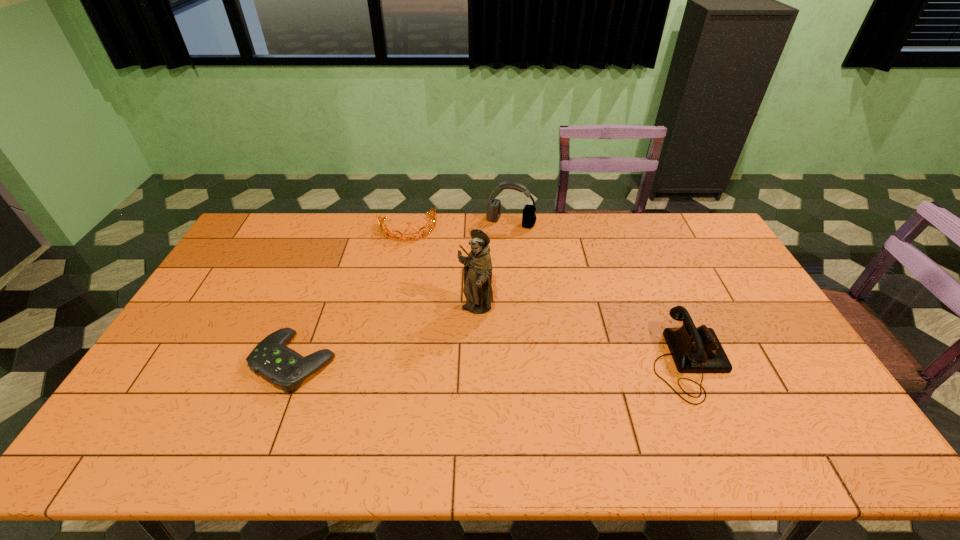
Where is `object that ranks as the third closest to the rightmost object`? The width and height of the screenshot is (960, 540). object that ranks as the third closest to the rightmost object is located at coordinates 432,227.

The image size is (960, 540). Find the location of `free region that satisfies the following two spatial constraints: 1. on the front side of the second tallest object; 2. on the front face of the telephone`. free region that satisfies the following two spatial constraints: 1. on the front side of the second tallest object; 2. on the front face of the telephone is located at coordinates (523, 362).

Find the location of `free space that satisfies the following two spatial constraints: 1. on the front side of the telephone; 2. on the front face of the fourth shortest object`. free space that satisfies the following two spatial constraints: 1. on the front side of the telephone; 2. on the front face of the fourth shortest object is located at coordinates (523, 362).

Where is `vacant space that satisfies the following two spatial constraints: 1. on the back side of the control; 2. on the right side of the headset`? Image resolution: width=960 pixels, height=540 pixels. vacant space that satisfies the following two spatial constraints: 1. on the back side of the control; 2. on the right side of the headset is located at coordinates (348, 222).

You are a GUI agent. You are given a task and a screenshot of the screen. Output one action in this format:
    pyautogui.click(x=<x>, y=<y>)
    Task: Click on the vacant position in the image that satisfies the following two spatial constraints: 1. on the front side of the telephone; 2. on the front face of the headset
    
    Given the screenshot: What is the action you would take?
    pyautogui.click(x=523, y=362)

The width and height of the screenshot is (960, 540). In order to click on free space that satisfies the following two spatial constraints: 1. on the back side of the figurine; 2. on the left side of the headset in this screenshot , I will do `click(476, 222)`.

This screenshot has height=540, width=960. I want to click on free location that satisfies the following two spatial constraints: 1. on the back side of the control; 2. on the left side of the tallest object, so click(x=315, y=309).